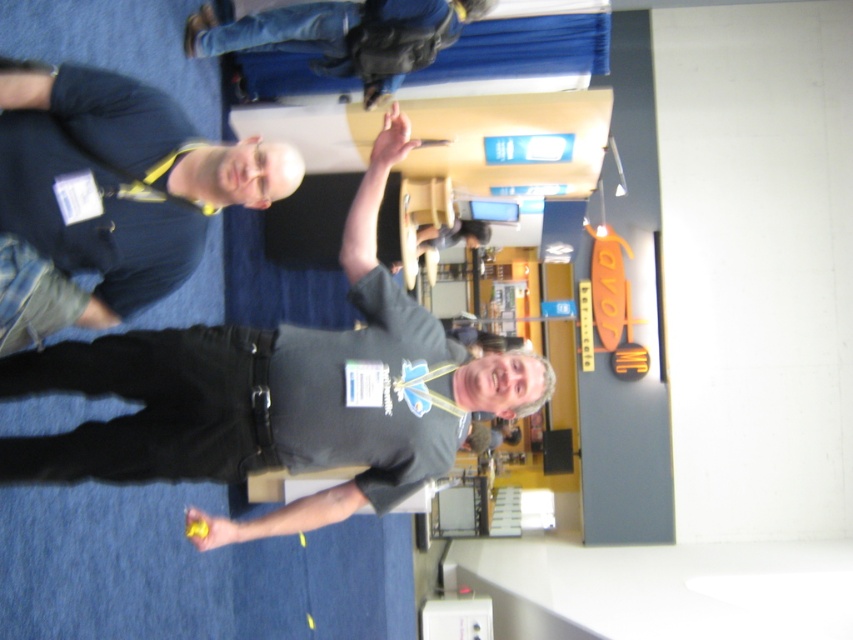
Is jeans at upper center in front of matte black lift at center?

Yes, jeans at upper center is closer to the viewer.

Is jeans at upper center smaller than matte black lift at center?

No.

Does point (282, 40) come closer to viewer compared to point (480, 200)?

Yes, it is.

This screenshot has height=640, width=853. In order to click on jeans at upper center in this screenshot , I will do `click(343, 35)`.

At what (x,y) coordinates should I click in order to perform the action: click on jeans at upper center. Please return your answer as a coordinate pair (x, y). The image size is (853, 640). Looking at the image, I should click on (343, 35).

Is point (434, 51) more distant than point (473, 227)?

No, it is in front of (473, 227).

Identify the location of jeans at upper center. This screenshot has width=853, height=640. (343, 35).

Is the position of dark blue shirt at left less distant than that of smooth gray shirt at center?

Yes, dark blue shirt at left is in front of smooth gray shirt at center.

Is point (212, 182) less distant than point (447, 236)?

Yes, it is.

You are a GUI agent. You are given a task and a screenshot of the screen. Output one action in this format:
    pyautogui.click(x=<x>, y=<y>)
    Task: Click on the dark blue shirt at left
    
    Given the screenshot: What is the action you would take?
    pyautogui.click(x=108, y=196)